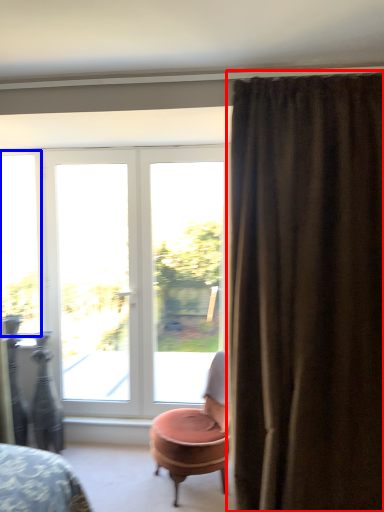
Question: Which object is further to the camera taking this photo, curtain (highlighted by a red box) or window (highlighted by a blue box)?

Choices:
 (A) curtain
 (B) window

Answer: (B)